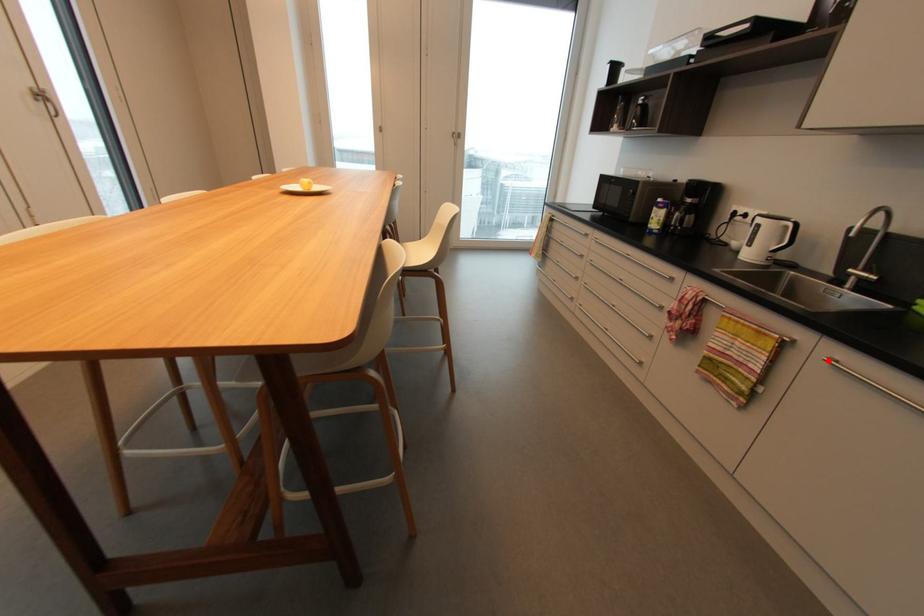
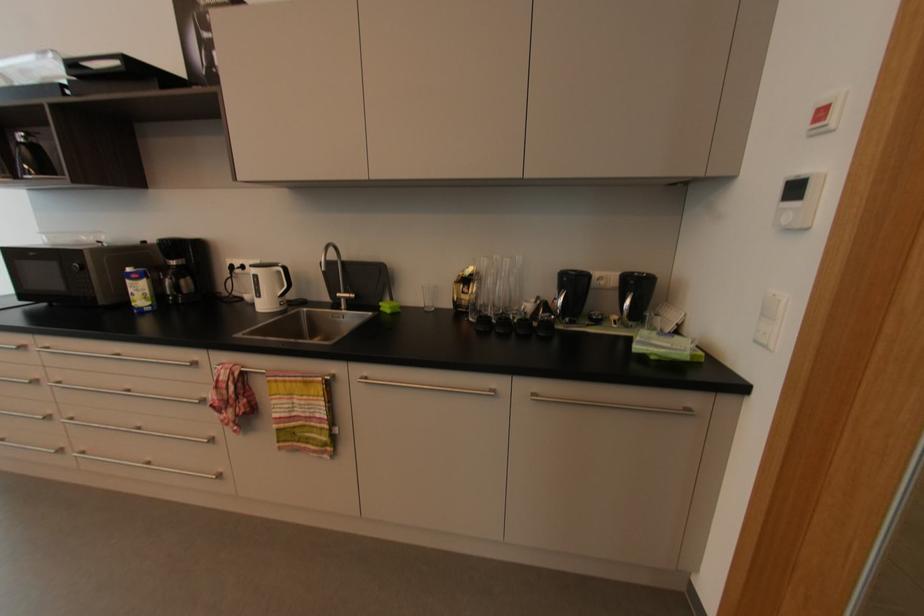
Question: I am providing you with two images of the same scene from different viewpoints. A red point is marked on the first image. Is the red point's position out of view in image 2?

Choices:
 (A) Yes
 (B) No

Answer: (B)